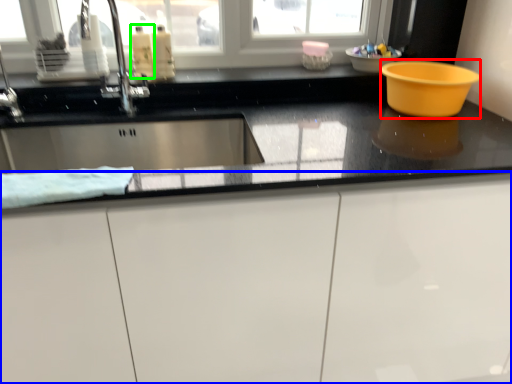
Question: Estimate the real-world distances between objects in this image. Which object is farther from basin (highlighted by a red box), cabinetry (highlighted by a blue box) or liquid (highlighted by a green box)?

Choices:
 (A) cabinetry
 (B) liquid

Answer: (B)